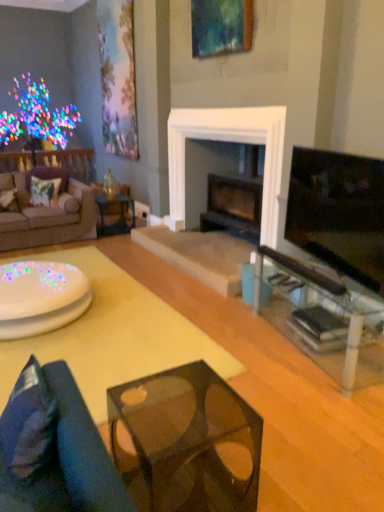
I want to click on free location in front of transparent glass table at right, marked as the 3th table in a left-to-right arrangement, so click(308, 413).